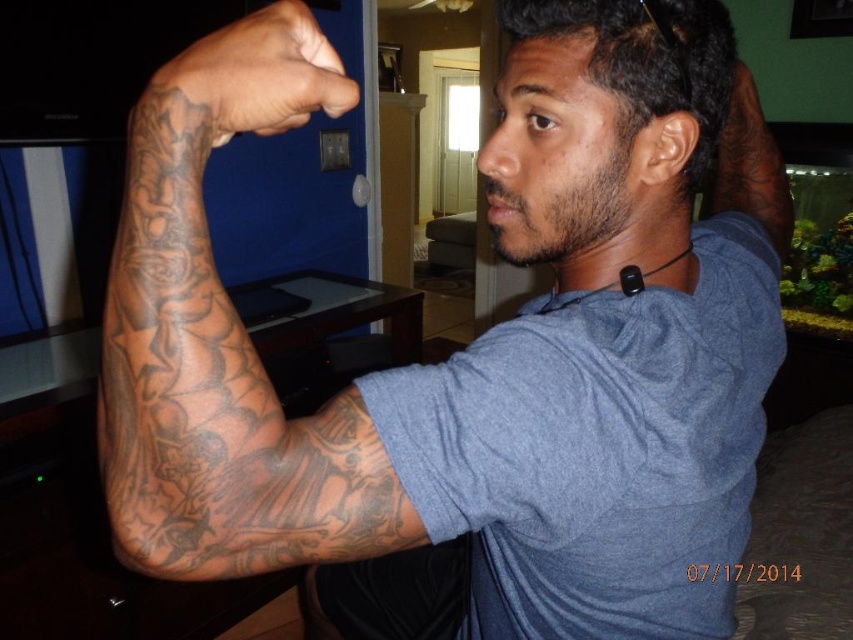
Question: Can you confirm if blue heathered t-shirt at upper right is positioned above dark skin tattooed hand at upper left?

Choices:
 (A) no
 (B) yes

Answer: (A)

Question: Is the position of blue heathered t-shirt at upper right less distant than that of black tattooed arm at left?

Choices:
 (A) no
 (B) yes

Answer: (A)

Question: Based on their relative distances, which object is farther from the black tattooed arm at left?

Choices:
 (A) blue heathered t-shirt at upper right
 (B) dark skin tattooed hand at upper left
 (C) black tattooed arm at upper right

Answer: (C)

Question: Is blue heathered t-shirt at upper right to the right of dark skin tattooed hand at upper left from the viewer's perspective?

Choices:
 (A) yes
 (B) no

Answer: (A)

Question: Which object is the farthest from the black tattooed arm at upper right?

Choices:
 (A) dark skin tattooed hand at upper left
 (B) black tattooed arm at left

Answer: (B)

Question: Which object is closer to the camera taking this photo?

Choices:
 (A) blue heathered t-shirt at upper right
 (B) dark skin tattooed hand at upper left
 (C) black tattooed arm at left

Answer: (C)